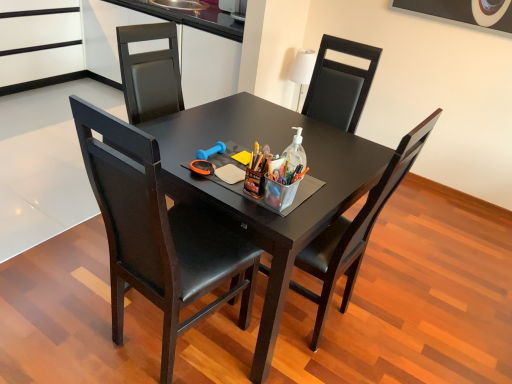
Question: From the image's perspective, does black leather chair at center, acting as the first chair starting from the right, appear lower than translucent plastic bottle at center?

Choices:
 (A) no
 (B) yes

Answer: (B)

Question: From a real-world perspective, is black leather chair at center, acting as the first chair starting from the right, physically above translucent plastic bottle at center?

Choices:
 (A) no
 (B) yes

Answer: (A)

Question: Considering the relative sizes of black leather chair at center, acting as the first chair starting from the right, and translucent plastic bottle at center in the image provided, is black leather chair at center, acting as the first chair starting from the right, taller than translucent plastic bottle at center?

Choices:
 (A) no
 (B) yes

Answer: (B)

Question: Are black leather chair at center, acting as the first chair starting from the right, and translucent plastic bottle at center making contact?

Choices:
 (A) yes
 (B) no

Answer: (B)

Question: Is black leather chair at center, which appears as the 2th chair when viewed from the left, not close to translucent plastic bottle at center?

Choices:
 (A) no
 (B) yes

Answer: (A)

Question: Does black leather chair at center, which appears as the 2th chair when viewed from the left, have a smaller size compared to translucent plastic bottle at center?

Choices:
 (A) no
 (B) yes

Answer: (A)

Question: Can translucent plastic bottle at center be found inside matte black chair at center, which is counted as the second chair, starting from the right?

Choices:
 (A) no
 (B) yes

Answer: (A)

Question: Considering the relative positions of matte black chair at center, which is counted as the second chair, starting from the right, and translucent plastic bottle at center in the image provided, is matte black chair at center, which is counted as the second chair, starting from the right, behind translucent plastic bottle at center?

Choices:
 (A) yes
 (B) no

Answer: (B)

Question: Does matte black chair at center, the 1th chair positioned from the left, touch translucent plastic bottle at center?

Choices:
 (A) no
 (B) yes

Answer: (A)

Question: Can you confirm if matte black chair at center, the 1th chair positioned from the left, is wider than translucent plastic bottle at center?

Choices:
 (A) yes
 (B) no

Answer: (A)

Question: Can you confirm if matte black chair at center, which is counted as the second chair, starting from the right, is positioned to the right of translucent plastic bottle at center?

Choices:
 (A) yes
 (B) no

Answer: (B)

Question: Can you confirm if matte black chair at center, which is counted as the second chair, starting from the right, is taller than translucent plastic bottle at center?

Choices:
 (A) yes
 (B) no

Answer: (A)

Question: Is black glossy table at center facing towards translucent plastic bottle at center?

Choices:
 (A) yes
 (B) no

Answer: (B)